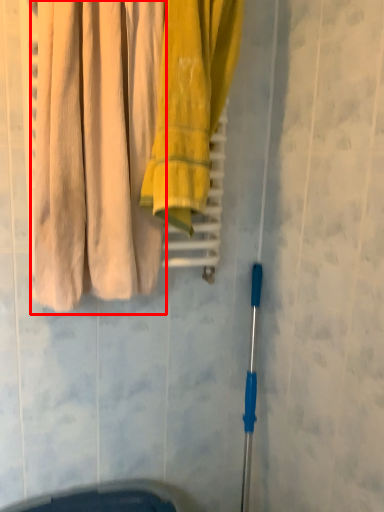
Question: From the image's perspective, what is the correct spatial relationship of curtain (annotated by the red box) in relation to towel?

Choices:
 (A) below
 (B) above

Answer: (A)